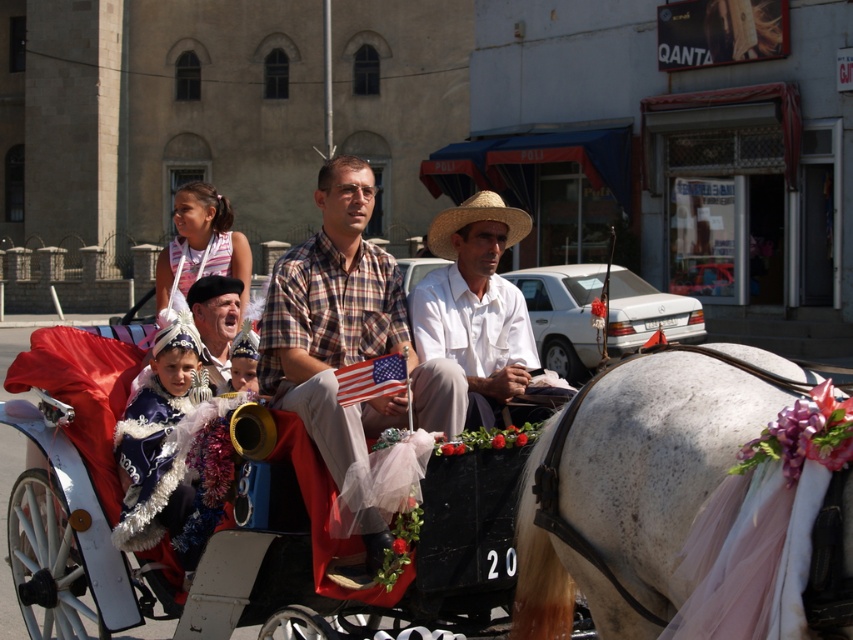
Between matte black beret at center and strawmaterial/texturecowboy hat at center, which one has more height?

strawmaterial/texturecowboy hat at center is taller.

Between point (194, 314) and point (511, 209), which one is positioned in front?

Point (511, 209)

What are the coordinates of `matte black beret at center` in the screenshot? It's located at (216, 321).

Does point (735, 372) lie in front of point (234, 285)?

Yes, point (735, 372) is in front of point (234, 285).

Does white glossy horse at center come in front of matte black beret at center?

Yes, white glossy horse at center is in front of matte black beret at center.

Locate an element on the screen. This screenshot has height=640, width=853. white glossy horse at center is located at coordinates (654, 458).

Can you confirm if white glossy horse at center is thinner than strawmaterial/texturecowboy hat at center?

Indeed, white glossy horse at center has a lesser width compared to strawmaterial/texturecowboy hat at center.

Who is shorter, white glossy horse at center or strawmaterial/texturecowboy hat at center?

white glossy horse at center

Is point (608, 474) farther from camera compared to point (525, 221)?

No, (608, 474) is closer to viewer.

This screenshot has height=640, width=853. Find the location of `white glossy horse at center`. white glossy horse at center is located at coordinates (654, 458).